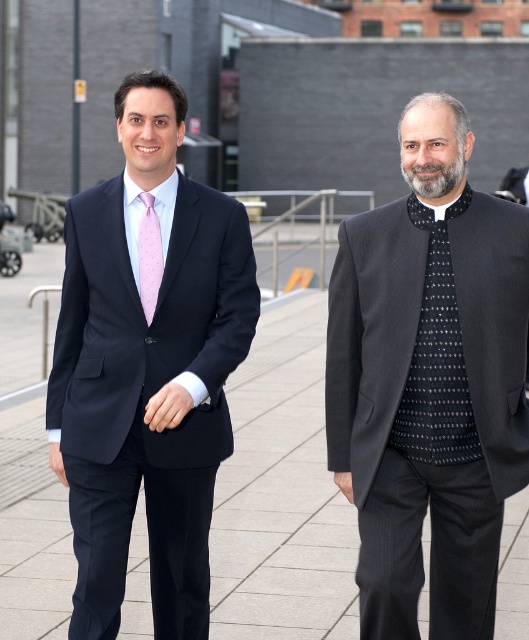
Who is positioned more to the left, dark gray textured suit at center or paved concrete at center?

paved concrete at center is more to the left.

How distant is dark gray textured suit at center from paved concrete at center?

2.86 meters

At what (x,y) coordinates should I click in order to perform the action: click on dark gray textured suit at center. Please return your answer as a coordinate pair (x, y). Looking at the image, I should click on (428, 403).

This screenshot has width=529, height=640. Identify the location of dark gray textured suit at center. (428, 403).

Who is lower down, dark gray textured suit at center or matte black suit at left?

dark gray textured suit at center is lower down.

Which is above, dark gray textured suit at center or matte black suit at left?

Positioned higher is matte black suit at left.

Locate an element on the screen. dark gray textured suit at center is located at coordinates (428, 403).

Is dark gray textured suit at center shorter than matte pink silk tie at left?

In fact, dark gray textured suit at center may be taller than matte pink silk tie at left.

Between point (382, 468) and point (142, 195), which one is positioned in front?

Point (382, 468)

At what (x,y) coordinates should I click in order to perform the action: click on dark gray textured suit at center. Please return your answer as a coordinate pair (x, y). This screenshot has height=640, width=529. Looking at the image, I should click on pyautogui.click(x=428, y=403).

Image resolution: width=529 pixels, height=640 pixels. Find the location of `dark gray textured suit at center`. dark gray textured suit at center is located at coordinates (428, 403).